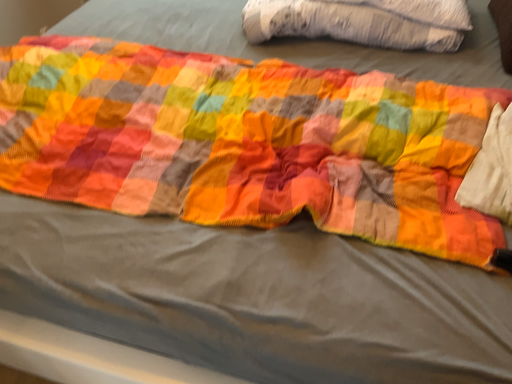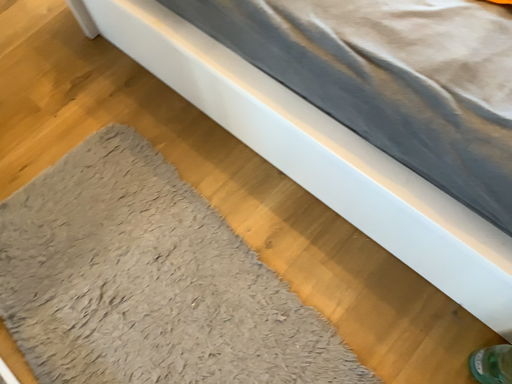
Question: Which way did the camera rotate in the video?

Choices:
 (A) rotated downward
 (B) rotated upward

Answer: (A)